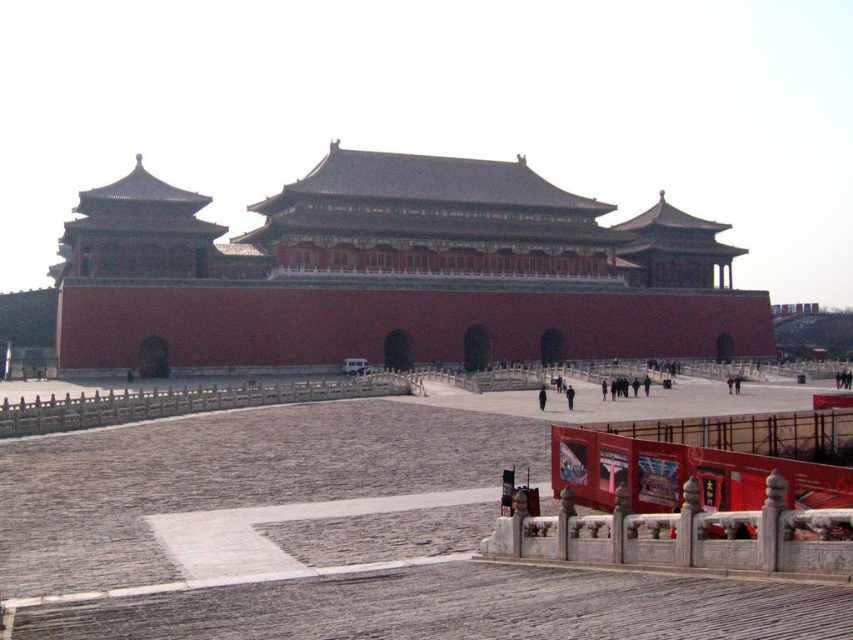
You are standing in the courtyard of the Forbidden City and want to take a photo of the smooth red wall at center. Where should you position yourself to capture the wall in the frame?

The smooth red wall at center is located at coordinates point (x=393, y=273), so you should position yourself facing the center area of the courtyard to capture it in your photo.